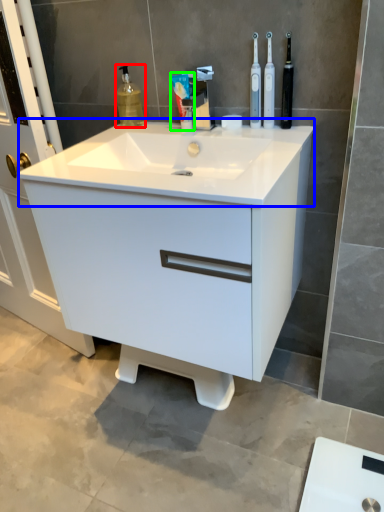
Question: Which object is positioned farthest from cleaning product (highlighted by a red box)? Select from counter top (highlighted by a blue box) and toothpaste (highlighted by a green box).

Choices:
 (A) counter top
 (B) toothpaste

Answer: (A)